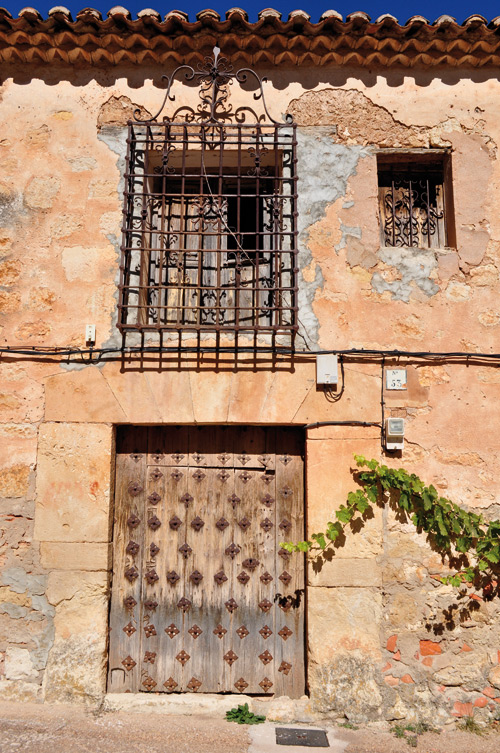
The image size is (500, 753). I want to click on green plants bottom right, so click(248, 718), click(359, 727), click(411, 729), click(470, 727).